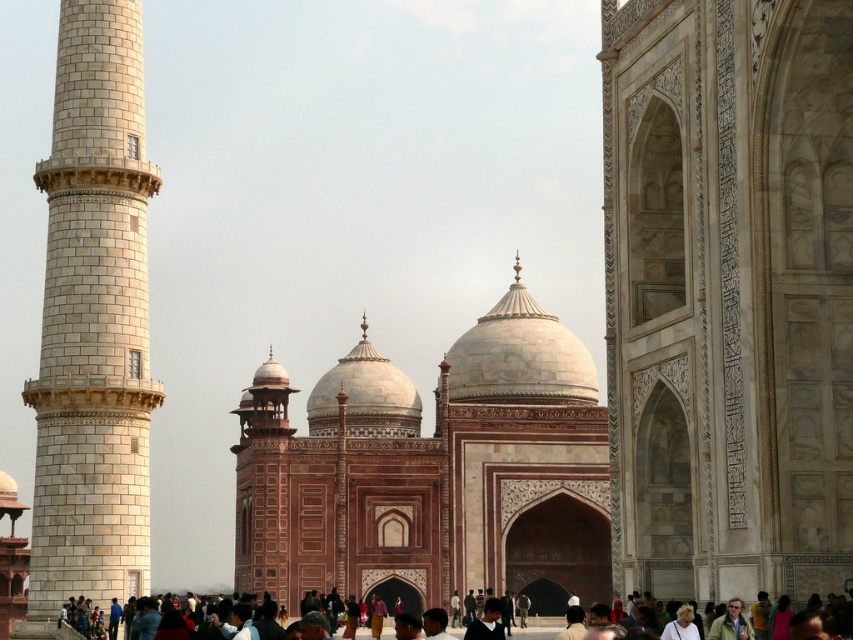
Does white marble archway at right have a larger size compared to white marble tower at left?

Incorrect, white marble archway at right is not larger than white marble tower at left.

You are a GUI agent. You are given a task and a screenshot of the screen. Output one action in this format:
    pyautogui.click(x=<x>, y=<y>)
    Task: Click on the white marble archway at right
    
    Given the screenshot: What is the action you would take?
    pyautogui.click(x=728, y=292)

This screenshot has height=640, width=853. Find the location of `white marble archway at right`. white marble archway at right is located at coordinates (728, 292).